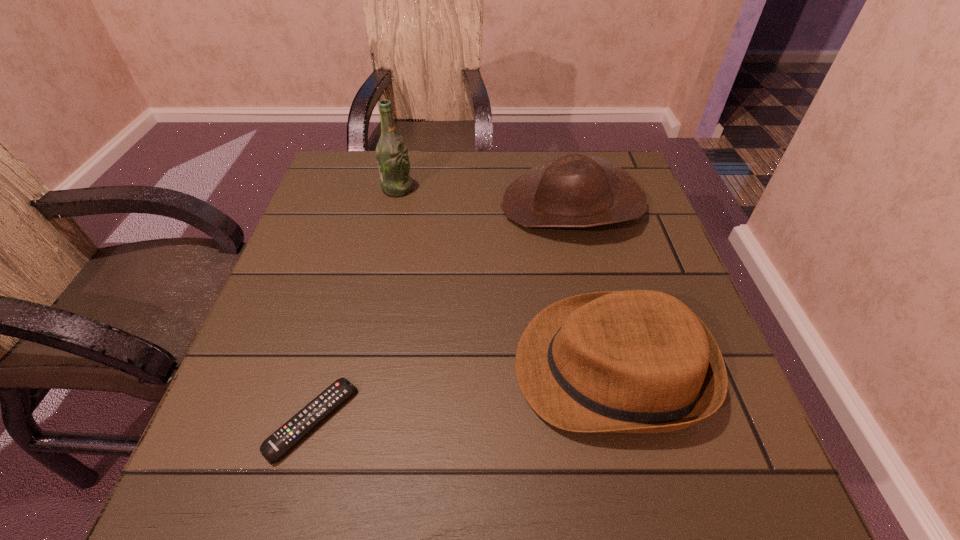
Locate an element on the screen. This screenshot has width=960, height=540. free space that satisfies the following two spatial constraints: 1. on the surface of the cowboy hat; 2. on the left side of the tallest object is located at coordinates (394, 206).

Locate an element on the screen. Image resolution: width=960 pixels, height=540 pixels. vacant position in the image that satisfies the following two spatial constraints: 1. on the surface of the cowboy hat; 2. on the right side of the beer bottle is located at coordinates point(394,206).